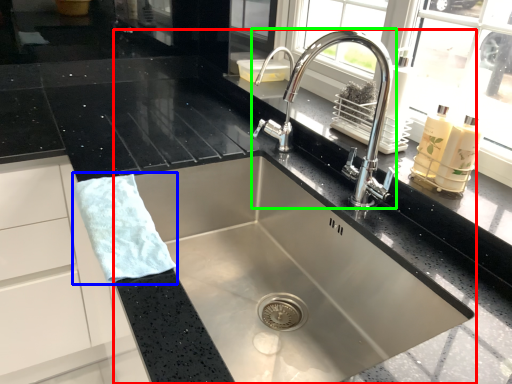
Question: Considering the real-world distances, which object is farthest from sink (highlighted by a red box)? hand towel (highlighted by a blue box) or tap (highlighted by a green box)?

Choices:
 (A) hand towel
 (B) tap

Answer: (A)